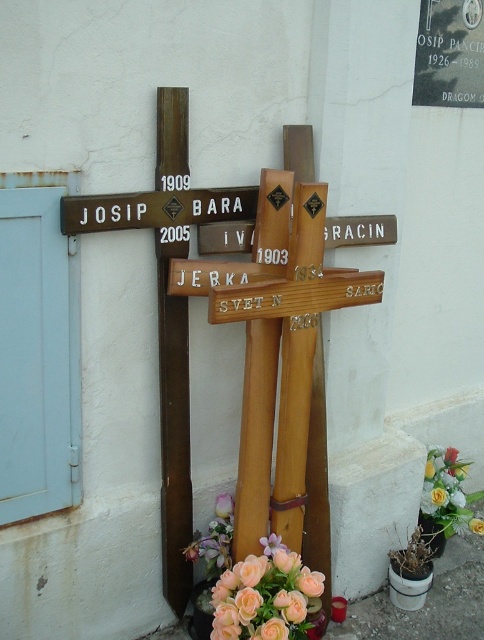
Can you confirm if soft peach petals at lower center is shorter than pink matte flower at center?

Incorrect, soft peach petals at lower center's height does not fall short of pink matte flower at center's.

Does soft peach petals at lower center come behind pink matte flower at center?

No.

Is point (273, 602) closer to camera compared to point (271, 552)?

Yes, point (273, 602) is closer to viewer.

Identify the location of soft peach petals at lower center. (266, 595).

Is point (460, 488) positioned after point (224, 500)?

Yes, it is.

Looking at this image, is white matte flowers at lower right closer to the viewer compared to pink silk flower at lower center?

No, white matte flowers at lower right is behind pink silk flower at lower center.

Is point (437, 456) positioned behind point (224, 502)?

That is True.

Image resolution: width=484 pixels, height=640 pixels. Find the location of `white matte flowers at lower right`. white matte flowers at lower right is located at coordinates pos(448,492).

Describe the element at coordinates (155, 209) in the screenshot. I see `brown wooden sign at center` at that location.

What do you see at coordinates (155, 209) in the screenshot?
I see `brown wooden sign at center` at bounding box center [155, 209].

Locate an element on the screen. This screenshot has height=640, width=484. brown wooden sign at center is located at coordinates (155, 209).